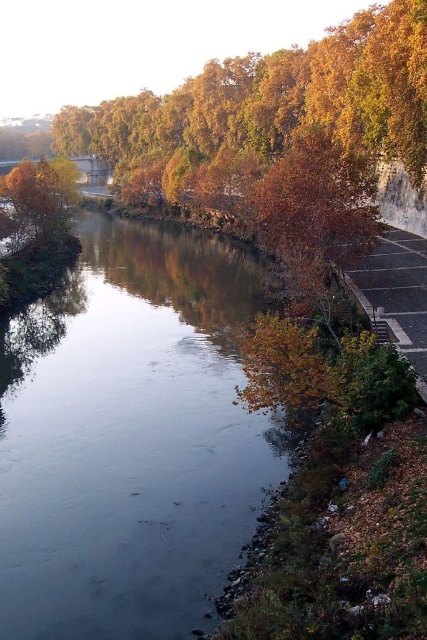
You are an artist planning to paint the riverside scene. You want to ensure the dark reflective water at center and the golden textured tree at lower left are proportionally accurate. Which object should you paint first to maintain the correct size relationship?

You should paint the golden textured tree at lower left first since the dark reflective water at center is larger, allowing you to adjust its size relative to the smaller tree afterward.

Based on the photo, you are planning to take a photo of the dark reflective water at center and the golden textured tree at lower left. Which object occupies a wider area in the image?

The dark reflective water at center occupies a wider area in the image as its width is larger than that of the golden textured tree at lower left.

You are standing on the riverside path and want to take a photo that includes both the dark reflective water at center and the golden textured tree at lower left. Which object should you position closer to the foreground to ensure both are in focus?

Since the dark reflective water at center is shorter in height than the golden textured tree at lower left, you should position the golden textured tree at lower left closer to the foreground to ensure both are in focus.